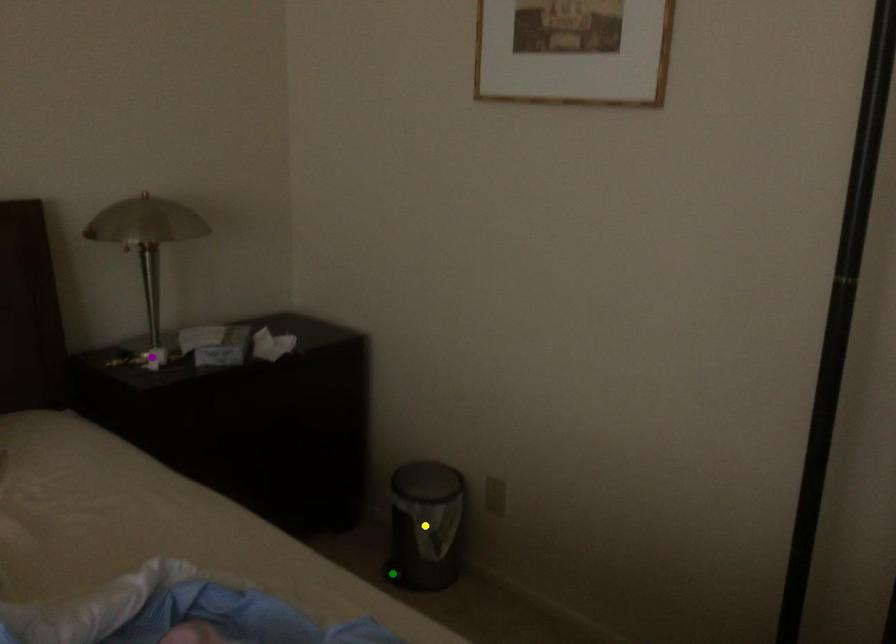
Order these from nearest to farthest:
yellow point, purple point, green point

1. purple point
2. yellow point
3. green point